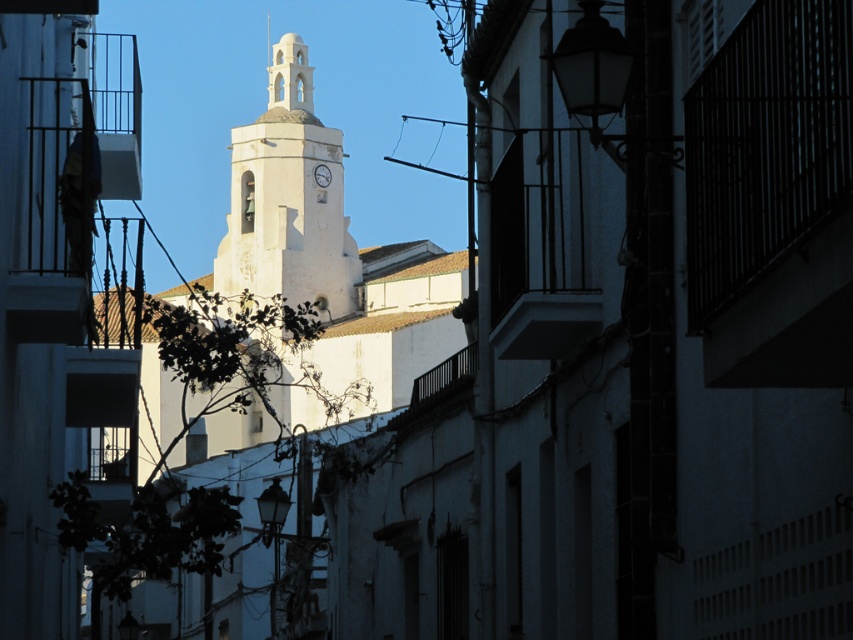
You are a tourist standing in front of the white stucco bell tower at center and the white glossy clock at center. Which object is closer to you?

The white stucco bell tower at center is closer to the viewer than the white glossy clock at center.

You are an architect assessing the proportions of the white stucco bell tower at center and the white glossy clock at center in the image. Which object has a greater width?

The white stucco bell tower at center has a greater width than the white glossy clock at center.